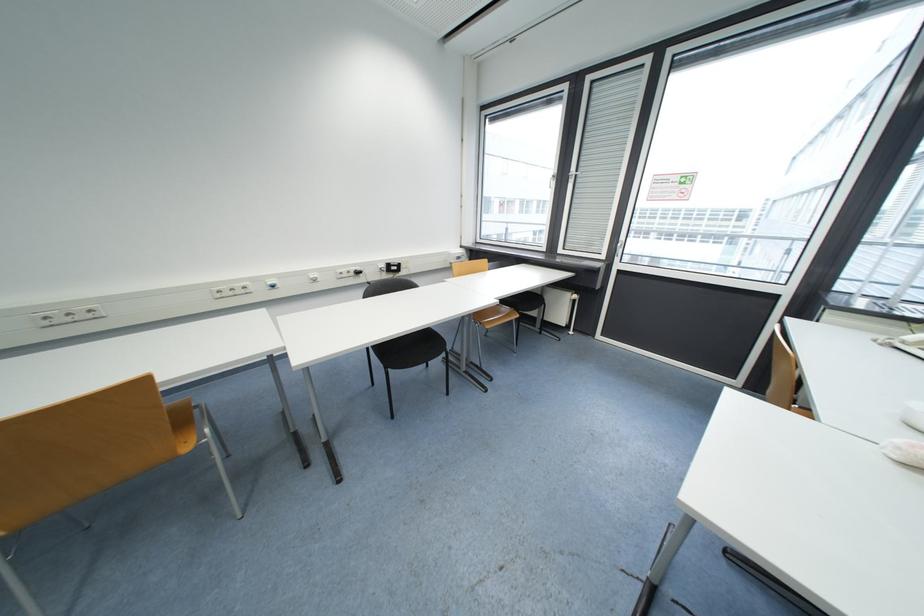
Where is `blue wall switch`? Image resolution: width=924 pixels, height=616 pixels. blue wall switch is located at coordinates (272, 283).